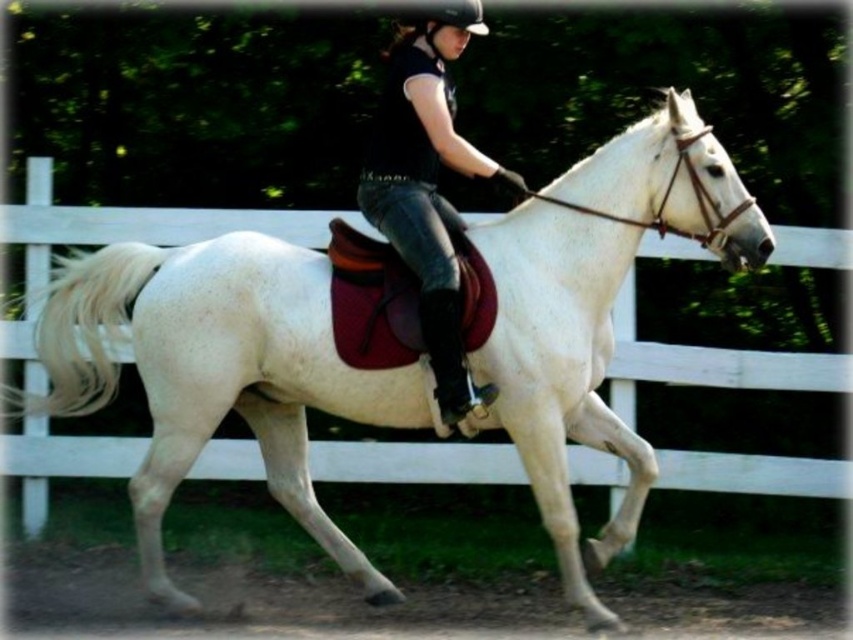
Question: Among these objects, which one is nearest to the camera?

Choices:
 (A) black hard helmet at upper center
 (B) black matte shirt at center

Answer: (B)

Question: Can you confirm if black matte shirt at center is bigger than black hard helmet at upper center?

Choices:
 (A) yes
 (B) no

Answer: (A)

Question: Which point is farther to the camera?

Choices:
 (A) (421, 60)
 (B) (410, 19)

Answer: (B)

Question: Observing the image, what is the correct spatial positioning of black matte shirt at center in reference to black hard helmet at upper center?

Choices:
 (A) above
 (B) below

Answer: (B)

Question: Is black matte shirt at center to the right of black hard helmet at upper center from the viewer's perspective?

Choices:
 (A) yes
 (B) no

Answer: (A)

Question: Which point is closer to the camera taking this photo?

Choices:
 (A) pyautogui.click(x=395, y=33)
 (B) pyautogui.click(x=473, y=35)

Answer: (B)